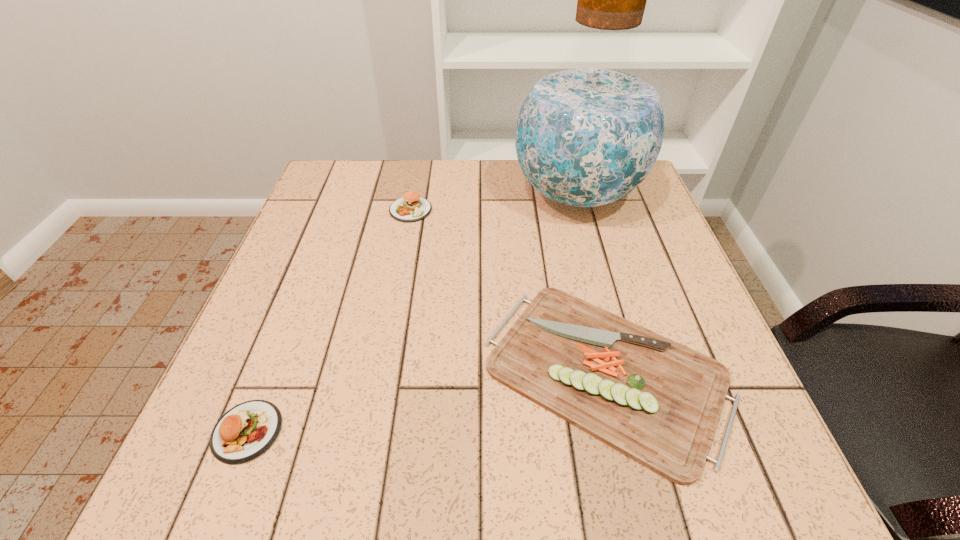
Identify the location of water jug that is at the far edge. The image size is (960, 540). 590,130.

This screenshot has width=960, height=540. In order to click on patty present at the far edge in this screenshot , I will do `click(411, 207)`.

Identify the location of patty (food) present at the near edge. This screenshot has width=960, height=540. (247, 430).

The height and width of the screenshot is (540, 960). What are the coordinates of `chopping board that is at the near edge` in the screenshot? It's located at (658, 402).

This screenshot has height=540, width=960. I want to click on object that is at the left edge, so click(247, 430).

At what (x,y) coordinates should I click in order to perform the action: click on water jug present at the right edge. Please return your answer as a coordinate pair (x, y). This screenshot has width=960, height=540. Looking at the image, I should click on (590, 130).

At what (x,y) coordinates should I click in order to perform the action: click on chopping board that is at the right edge. Please return your answer as a coordinate pair (x, y). The height and width of the screenshot is (540, 960). Looking at the image, I should click on (658, 402).

Locate an element on the screen. Image resolution: width=960 pixels, height=540 pixels. object positioned at the near left corner is located at coordinates (247, 430).

This screenshot has width=960, height=540. I want to click on object that is positioned at the far right corner, so click(x=590, y=130).

This screenshot has height=540, width=960. Identify the location of object that is at the near right corner. (658, 402).